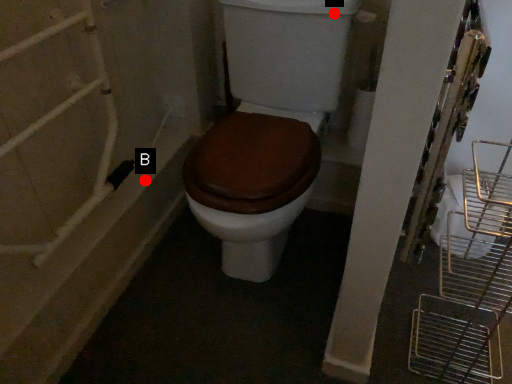
Question: Two points are circled on the image, labeled by A and B beside each circle. Which point is closer to the camera?

Choices:
 (A) A is closer
 (B) B is closer

Answer: (A)